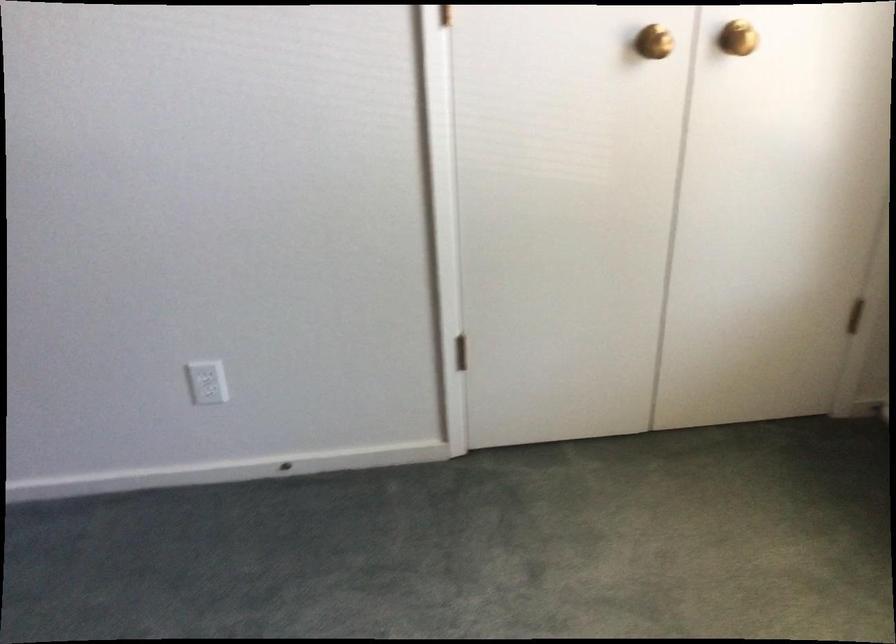
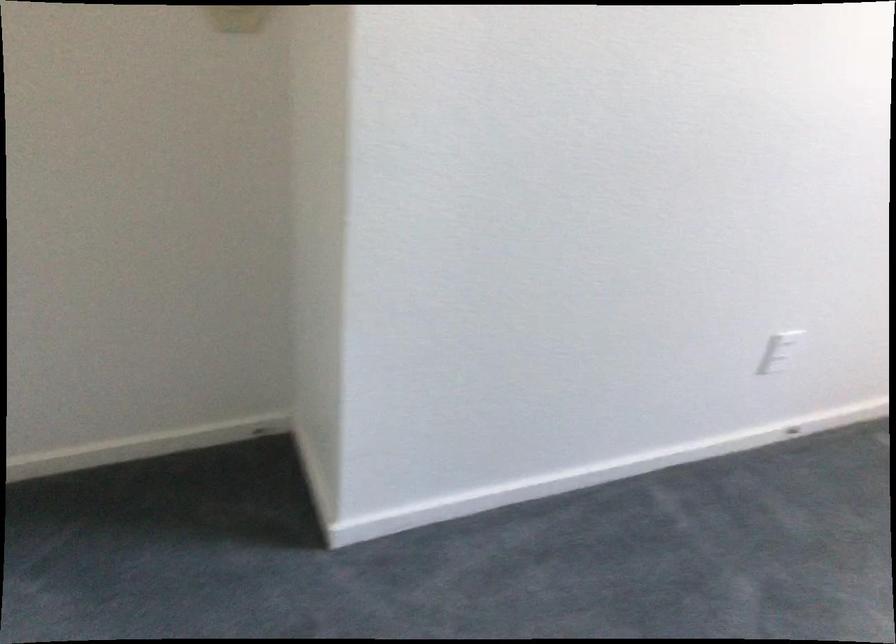
Question: The images are taken continuously from a first-person perspective. In which direction are you moving?

Choices:
 (A) Left
 (B) Right
 (C) Forward
 (D) Backward

Answer: (A)